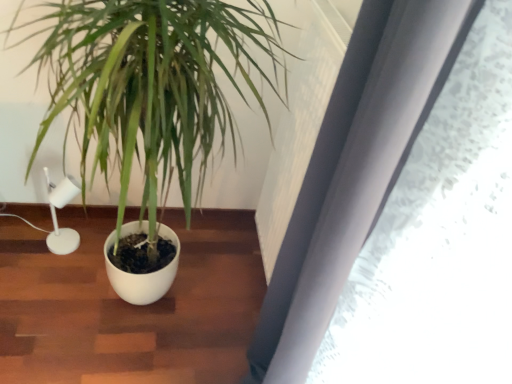
At what (x,y) coordinates should I click in order to perform the action: click on free space in front of white matte lamp at left. Please return your answer as a coordinate pair (x, y). This screenshot has height=384, width=512. Looking at the image, I should click on (49, 272).